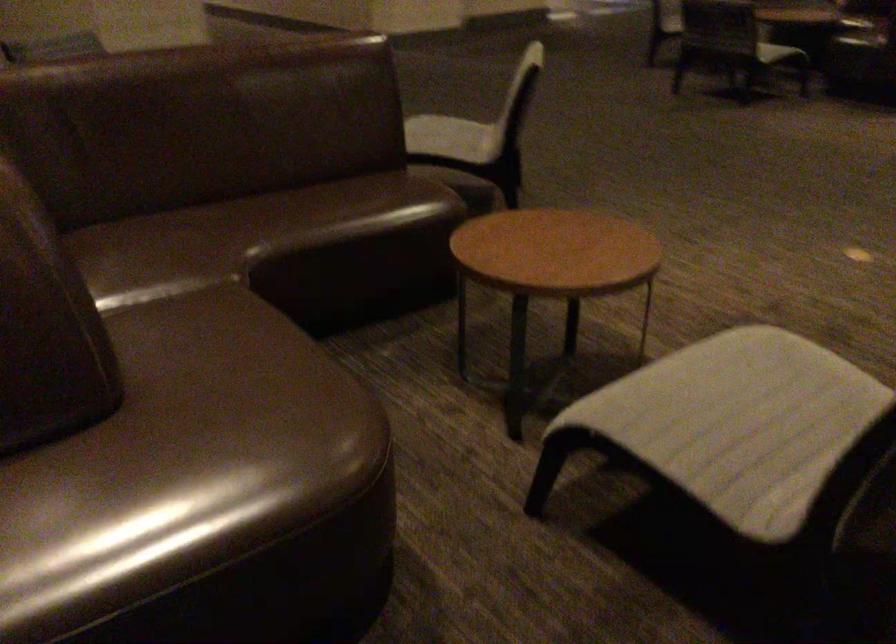
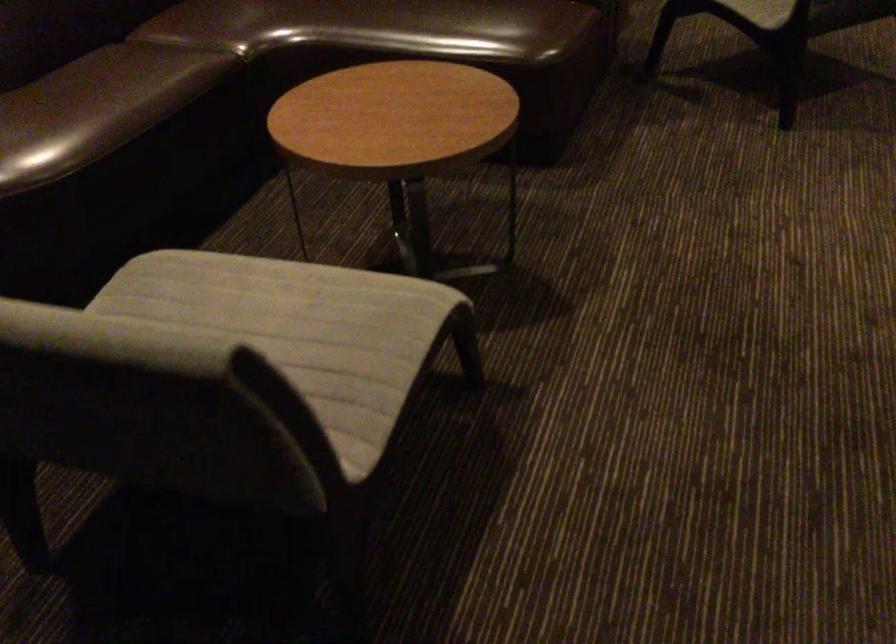
The point at (724,377) is marked in the first image. Where is the corresponding point in the second image?

(280, 299)